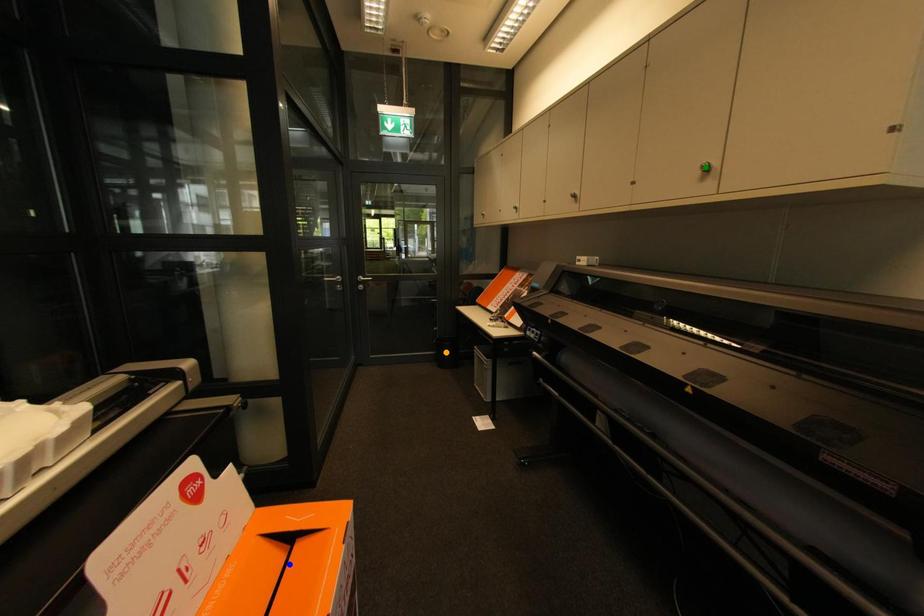
Order these from farthest to nearest:
1. orange point
2. green point
3. blue point

orange point
green point
blue point